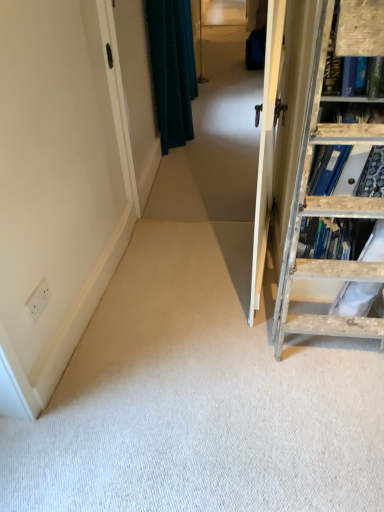
The height and width of the screenshot is (512, 384). In order to click on teal fabric curtain at upper left in this screenshot , I will do `click(215, 142)`.

Measure the distance between point (296, 214) and camera.

The distance of point (296, 214) from camera is 4.95 feet.

At what (x,y) coordinates should I click in order to perform the action: click on teal fabric curtain at upper left. Please return your answer as a coordinate pair (x, y). This screenshot has height=512, width=384. Looking at the image, I should click on (215, 142).

Is teal fabric curtain at upper left located outside teal velvet curtain at upper center?

teal fabric curtain at upper left lies outside teal velvet curtain at upper center's area.

Between teal fabric curtain at upper left and teal velvet curtain at upper center, which one has larger size?

Bigger between the two is teal velvet curtain at upper center.

From a real-world perspective, is teal fabric curtain at upper left physically below teal velvet curtain at upper center?

No.

Considering the points (224, 90) and (186, 131), which point is in front, point (224, 90) or point (186, 131)?

Positioned in front is point (186, 131).

In the scene shown: Is teal velvet curtain at upper center closer to the viewer compared to wooden ladder at right?

No, teal velvet curtain at upper center is further to the viewer.

Considering the sizes of objects teal velvet curtain at upper center and wooden ladder at right in the image provided, who is wider, teal velvet curtain at upper center or wooden ladder at right?

Wider between the two is wooden ladder at right.

Is teal velvet curtain at upper center smaller than wooden ladder at right?

No, teal velvet curtain at upper center is not smaller than wooden ladder at right.

How far apart are teal velvet curtain at upper center and wooden ladder at right?

teal velvet curtain at upper center is 6.78 feet from wooden ladder at right.

Could you tell me if teal velvet curtain at upper center is facing teal fabric curtain at upper left?

No.

Looking at this image, between teal velvet curtain at upper center and teal fabric curtain at upper left, which one has larger size?

With larger size is teal velvet curtain at upper center.

From a real-world perspective, is teal velvet curtain at upper center located beneath teal fabric curtain at upper left?

Indeed, from a real-world perspective, teal velvet curtain at upper center is positioned beneath teal fabric curtain at upper left.

How different are the orientations of teal velvet curtain at upper center and teal fabric curtain at upper left in degrees?

There is a 92.8-degree angle between the facing directions of teal velvet curtain at upper center and teal fabric curtain at upper left.

From the image's perspective, which one is positioned higher, wooden ladder at right or teal fabric curtain at upper left?

From the image's view, teal fabric curtain at upper left is above.

Can you see wooden ladder at right touching teal fabric curtain at upper left?

No, wooden ladder at right is not making contact with teal fabric curtain at upper left.

Is point (308, 327) more distant than point (249, 209)?

No, (308, 327) is closer to viewer.

Is wooden ladder at right facing away from teal fabric curtain at upper left?

No, wooden ladder at right is not facing away from teal fabric curtain at upper left.

Is wooden ladder at right to the right of teal velvet curtain at upper center from the viewer's perspective?

Correct, you'll find wooden ladder at right to the right of teal velvet curtain at upper center.

Find the location of `curtain above the wooden ladder at right (from the image's perspective)`. curtain above the wooden ladder at right (from the image's perspective) is located at coordinates pyautogui.click(x=172, y=69).

Is wooden ladder at right far from teal velvet curtain at upper center?

Yes.

Looking at this image, from the image's perspective, which is below, wooden ladder at right or teal velvet curtain at upper center?

wooden ladder at right appears lower in the image.

Locate an element on the screen. This screenshot has height=512, width=384. ladder located underneath the teal fabric curtain at upper left (from a real-world perspective) is located at coordinates (325, 215).

Which is behind, teal fabric curtain at upper left or wooden ladder at right?

teal fabric curtain at upper left is further from the camera.

Is teal fabric curtain at upper left smaller than wooden ladder at right?

Yes.

Can you tell me how much teal fabric curtain at upper left and wooden ladder at right differ in facing direction?

There is a 1.63-degree angle between the facing directions of teal fabric curtain at upper left and wooden ladder at right.

Image resolution: width=384 pixels, height=512 pixels. In order to click on curtain that appears behind the teal fabric curtain at upper left in this screenshot , I will do `click(172, 69)`.

Where is `ladder lying in front of the teal velvet curtain at upper center`? The image size is (384, 512). ladder lying in front of the teal velvet curtain at upper center is located at coordinates (325, 215).

Estimate the real-world distances between objects in this image. Which object is further from wooden ladder at right, teal velvet curtain at upper center or teal fabric curtain at upper left?

teal velvet curtain at upper center.

Which object lies further to the anchor point teal fabric curtain at upper left, wooden ladder at right or teal velvet curtain at upper center?

The object further to teal fabric curtain at upper left is wooden ladder at right.

From the image, which object appears to be nearer to teal velvet curtain at upper center, teal fabric curtain at upper left or wooden ladder at right?

teal fabric curtain at upper left.

Considering their positions, is wooden ladder at right positioned closer to teal velvet curtain at upper center than teal fabric curtain at upper left?

teal fabric curtain at upper left is positioned closer to the anchor teal velvet curtain at upper center.

Estimate the real-world distances between objects in this image. Which object is closer to teal fabric curtain at upper left, teal velvet curtain at upper center or wooden ladder at right?

Among the two, teal velvet curtain at upper center is located nearer to teal fabric curtain at upper left.

When comparing their distances from wooden ladder at right, does teal fabric curtain at upper left or teal velvet curtain at upper center seem closer?

teal fabric curtain at upper left.

The width and height of the screenshot is (384, 512). I want to click on passage between teal velvet curtain at upper center and wooden ladder at right from top to bottom, so click(x=215, y=142).